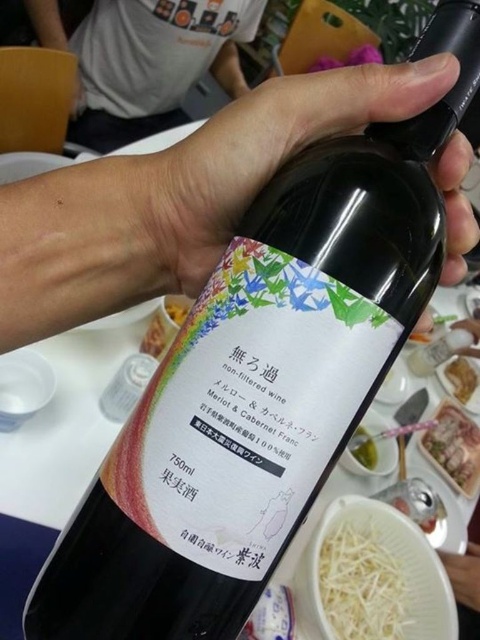
You are a photographer adjusting your camera focus. You need to focus on either the point at (332, 552) or the point at (166, 305). Which point should you focus on if you want to capture the closest object in the scene?

You should focus on point (332, 552) because it is closer to the camera than point (166, 305).

You are a chef preparing a dish and notice the white stringy food at lower center on your table. If you want to grab it quickly, can you reach it without moving your chair? The average arm length is 28 inches.

The white stringy food at lower center is 32.00 inches away from you, which is beyond the average arm length of 28 inches. Therefore, you would need to move your chair closer to reach it.